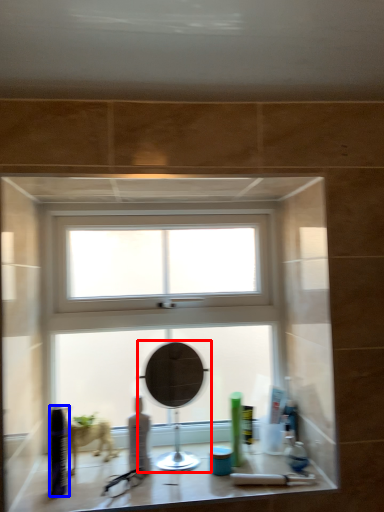
Question: Which object appears closest to the camera in this image, mirror (highlighted by a red box) or toiletry (highlighted by a blue box)?

Choices:
 (A) mirror
 (B) toiletry

Answer: (B)